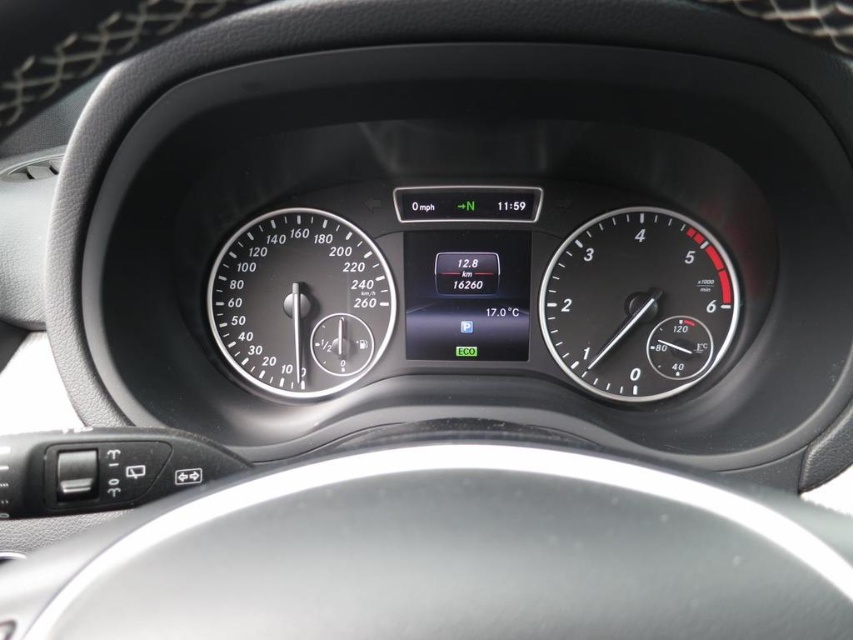
Looking at this image, you are sitting in the driver seat and want to check the speedometer. Which one is easier to see between the black metallic speedometer at center right and the black glass speedometer at center?

The black metallic speedometer at center right is closer to the viewer than the black glass speedometer at center, so it is easier to see.

You are driving a car and notice two speedometers on the dashboard. The black metallic speedometer at center right and the black glass speedometer at center. Which one is positioned lower on the dashboard?

The black metallic speedometer at center right is positioned lower on the dashboard because it is below the black glass speedometer at center.

You are a driver checking your car dashboard. You notice the black metallic speedometer at center right and the black glass speedometer at center. Which one is taller?

The black metallic speedometer at center right is much taller than the black glass speedometer at center.